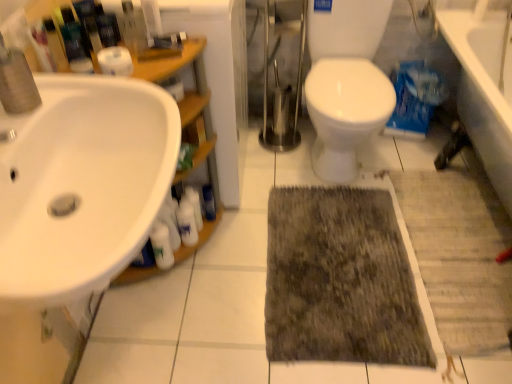
Identify the location of free space in front of white glossy bottle at lower left, marked as the second toiletry in a right-to-left arrangement. This screenshot has width=512, height=384. (199, 271).